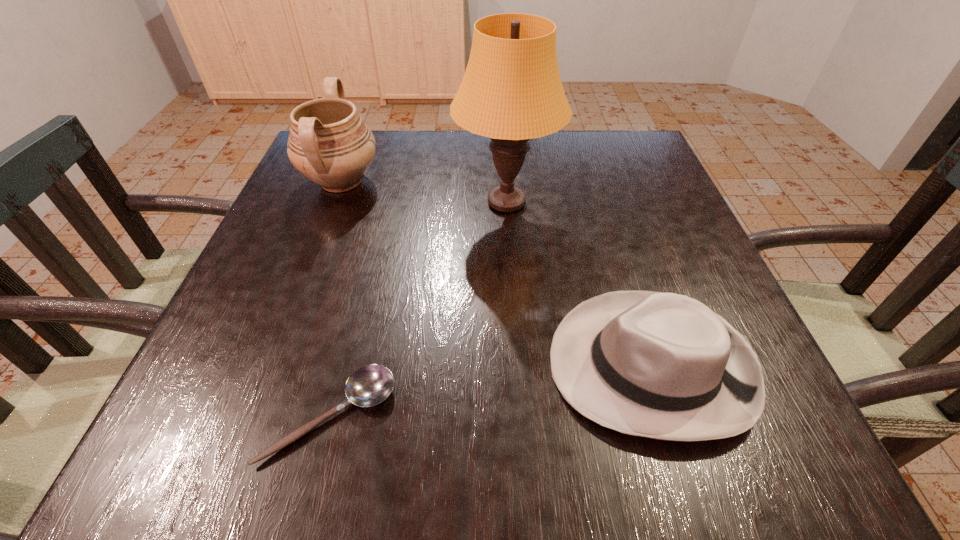
The width and height of the screenshot is (960, 540). I want to click on free space at the far edge of the desktop, so click(x=391, y=168).

Identify the location of vacant space at the near edge of the desktop. (469, 449).

The height and width of the screenshot is (540, 960). Find the location of `vacant space at the left edge`. vacant space at the left edge is located at coordinates (242, 399).

Where is `vacant space at the right edge of the desktop`? vacant space at the right edge of the desktop is located at coordinates (634, 201).

At what (x,y) coordinates should I click in order to perform the action: click on vacant area at the near left corner of the desktop. Please return your answer as a coordinate pair (x, y). The height and width of the screenshot is (540, 960). Looking at the image, I should click on (235, 412).

At what (x,y) coordinates should I click in order to perform the action: click on empty space that is in between the second tallest object and the third tallest object. Please return your answer as a coordinate pair (x, y). This screenshot has height=540, width=960. Looking at the image, I should click on (495, 273).

Identify the location of blank region between the tallest object and the ladle. This screenshot has width=960, height=540. (419, 309).

Where is `vacant point located between the urn and the tallest object`? Image resolution: width=960 pixels, height=540 pixels. vacant point located between the urn and the tallest object is located at coordinates (423, 192).

The image size is (960, 540). In order to click on empty space that is in between the shortest object and the second shortest object in this screenshot , I will do `click(491, 391)`.

You are a GUI agent. You are given a task and a screenshot of the screen. Output one action in this format:
    pyautogui.click(x=<x>, y=<y>)
    Task: Click on the free spot between the ladle and the fedora
    The image size is (960, 540).
    Given the screenshot: What is the action you would take?
    pyautogui.click(x=491, y=391)